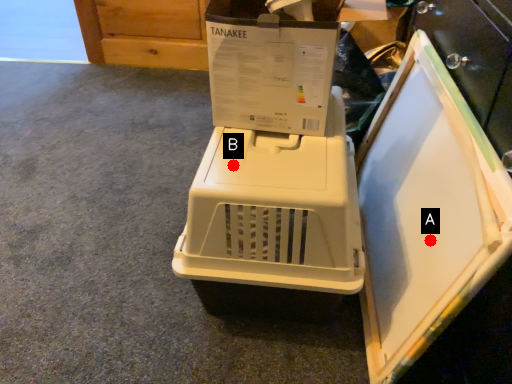
Question: Two points are circled on the image, labeled by A and B beside each circle. Which point is closer to the camera taking this photo?

Choices:
 (A) A is closer
 (B) B is closer

Answer: (A)